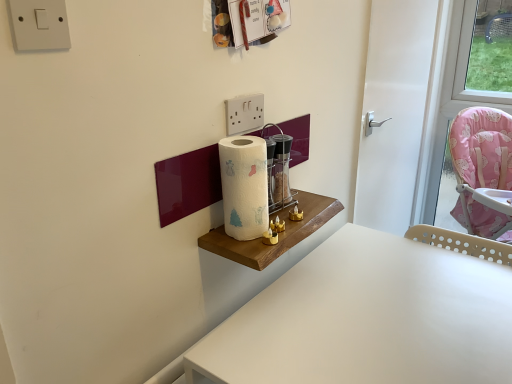
Question: Is transparent glass wine bottle at center shorter than white glossy door at center?

Choices:
 (A) no
 (B) yes

Answer: (B)

Question: From the image's perspective, is transparent glass wine bottle at center below white glossy door at center?

Choices:
 (A) yes
 (B) no

Answer: (A)

Question: Is transparent glass wine bottle at center outside white glossy door at center?

Choices:
 (A) yes
 (B) no

Answer: (A)

Question: Does transparent glass wine bottle at center appear on the right side of white glossy door at center?

Choices:
 (A) no
 (B) yes

Answer: (A)

Question: From a real-world perspective, is transparent glass wine bottle at center positioned under white glossy door at center based on gravity?

Choices:
 (A) yes
 (B) no

Answer: (B)

Question: Considering the positions of white plastic table at lower right and white glossy door at center in the image, is white plastic table at lower right bigger or smaller than white glossy door at center?

Choices:
 (A) big
 (B) small

Answer: (A)

Question: In the image, is white plastic table at lower right positioned in front of or behind white glossy door at center?

Choices:
 (A) front
 (B) behind

Answer: (A)

Question: Considering the positions of white plastic table at lower right and white glossy door at center in the image, is white plastic table at lower right wider or thinner than white glossy door at center?

Choices:
 (A) wide
 (B) thin

Answer: (A)

Question: In terms of height, does white plastic table at lower right look taller or shorter compared to white glossy door at center?

Choices:
 (A) short
 (B) tall

Answer: (A)

Question: Is point tap(373, 187) positioned closer to the camera than point tap(226, 132)?

Choices:
 (A) farther
 (B) closer

Answer: (A)

Question: Considering the positions of white glossy door at center and white plastic/light switch at upper center in the image, is white glossy door at center bigger or smaller than white plastic/light switch at upper center?

Choices:
 (A) big
 (B) small

Answer: (A)

Question: Is white glossy door at center to the left or to the right of white plastic/light switch at upper center in the image?

Choices:
 (A) left
 (B) right

Answer: (B)

Question: In the image, is white glossy door at center positioned in front of or behind white plastic/light switch at upper center?

Choices:
 (A) front
 (B) behind

Answer: (B)

Question: Considering the positions of white plastic/light switch at upper center and white paper towel at center in the image, is white plastic/light switch at upper center wider or thinner than white paper towel at center?

Choices:
 (A) wide
 (B) thin

Answer: (B)

Question: Considering the positions of point (232, 125) and point (245, 190), is point (232, 125) closer or farther from the camera than point (245, 190)?

Choices:
 (A) farther
 (B) closer

Answer: (A)